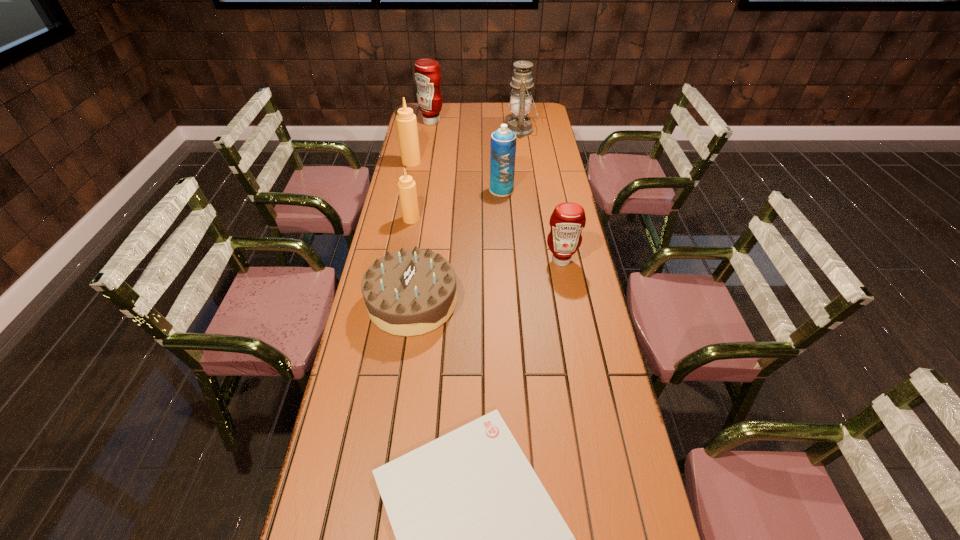
Identify the location of the second nearest object. (409, 292).

Identify the location of birthday cake. The width and height of the screenshot is (960, 540). (409, 292).

The image size is (960, 540). I want to click on free space located 0.310m on the front of the oil lamp, so click(x=527, y=175).

Find the location of a particular element. The width and height of the screenshot is (960, 540). vacant space located 0.200m on the right of the third nearest condiment is located at coordinates (465, 162).

You are a GUI agent. You are given a task and a screenshot of the screen. Output one action in this format:
    pyautogui.click(x=<x>, y=<y>)
    Task: Click on the free space located on the front of the left red condiment
    This screenshot has height=540, width=960.
    Given the screenshot: What is the action you would take?
    pyautogui.click(x=429, y=137)

The image size is (960, 540). Find the location of `free space located 0.210m on the left of the aerosol can`. free space located 0.210m on the left of the aerosol can is located at coordinates (440, 190).

Locate an element on the screen. vacant space located 0.140m on the right of the nearer tan condiment is located at coordinates (455, 219).

At what (x,y) coordinates should I click in order to perform the action: click on vacant space located 0.270m on the front of the right red condiment. Please return your answer as a coordinate pair (x, y). Image resolution: width=960 pixels, height=540 pixels. Looking at the image, I should click on (574, 330).

The image size is (960, 540). What are the coordinates of `blank space located on the front-facing side of the seventh farthest object` in the screenshot? It's located at (526, 302).

Image resolution: width=960 pixels, height=540 pixels. I want to click on oil lamp that is at the far edge, so click(520, 102).